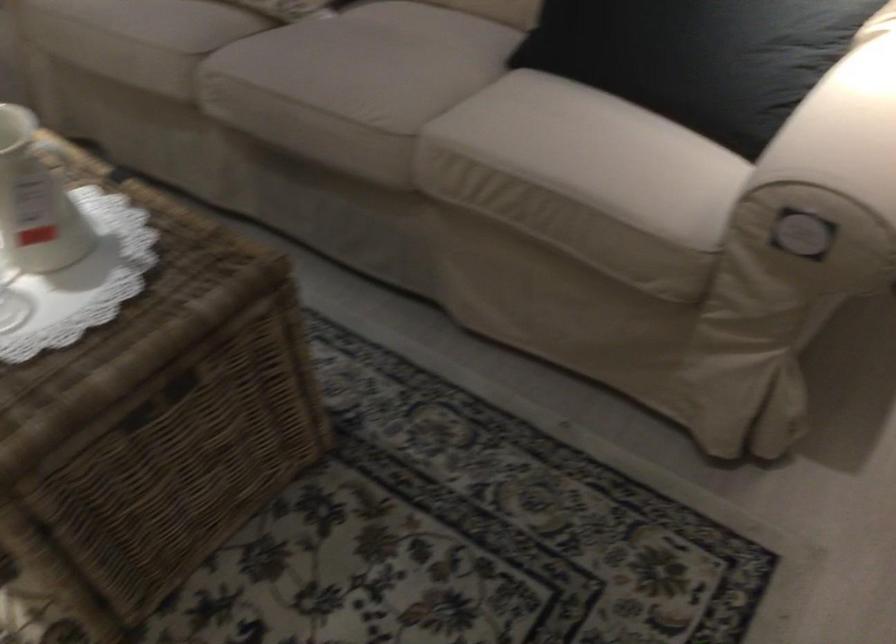
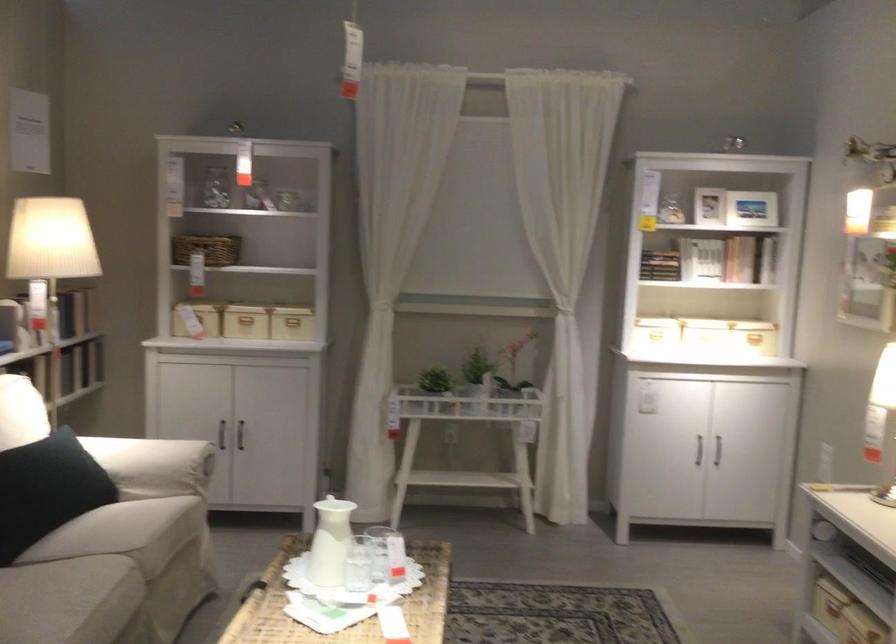
Locate, in the second image, the point that corresponds to (798,133) in the first image.

(152, 465)